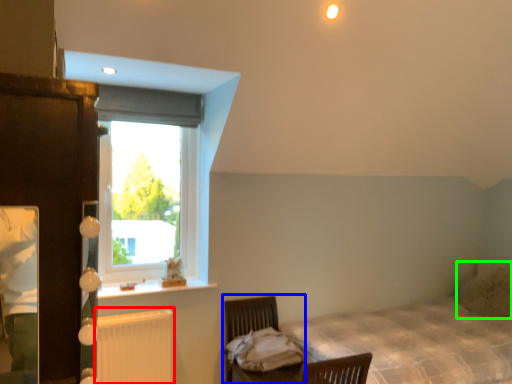
Question: Which object is positioned farthest from radiator (highlighted by a red box)? Select from swivel chair (highlighted by a blue box) and pillow (highlighted by a green box).

Choices:
 (A) swivel chair
 (B) pillow

Answer: (B)